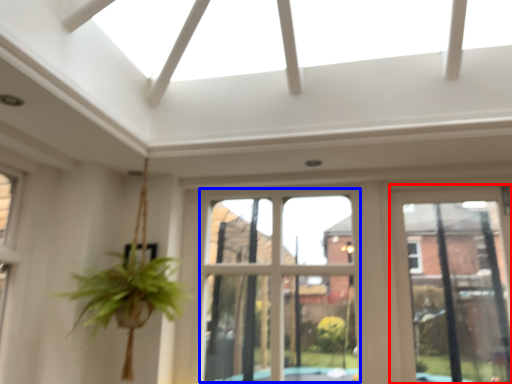
Question: Among these objects, which one is farthest to the camera, window frame (highlighted by a red box) or bay window (highlighted by a blue box)?

Choices:
 (A) window frame
 (B) bay window

Answer: (A)